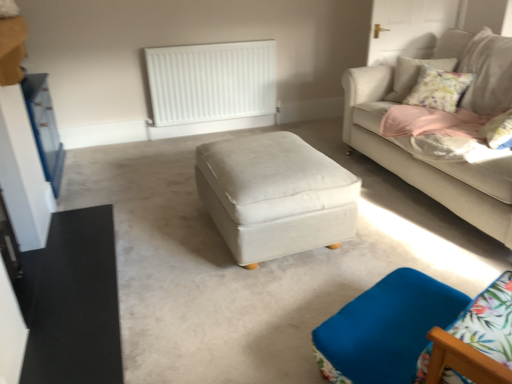
Question: Is the position of white matte radiator at upper center less distant than that of satin white ottoman at center?

Choices:
 (A) no
 (B) yes

Answer: (A)

Question: From the image's perspective, is white matte radiator at upper center beneath satin white ottoman at center?

Choices:
 (A) yes
 (B) no

Answer: (B)

Question: Is white matte radiator at upper center smaller than satin white ottoman at center?

Choices:
 (A) no
 (B) yes

Answer: (B)

Question: Is white matte radiator at upper center shorter than satin white ottoman at center?

Choices:
 (A) no
 (B) yes

Answer: (A)

Question: Does white matte radiator at upper center appear on the right side of satin white ottoman at center?

Choices:
 (A) no
 (B) yes

Answer: (A)

Question: Considering the relative sizes of white matte radiator at upper center and satin white ottoman at center in the image provided, is white matte radiator at upper center taller than satin white ottoman at center?

Choices:
 (A) no
 (B) yes

Answer: (B)

Question: Is light beige fabric couch at upper right placed right next to blue fabric swivel chair at lower right?

Choices:
 (A) no
 (B) yes

Answer: (A)

Question: Is light beige fabric couch at upper right turned away from blue fabric swivel chair at lower right?

Choices:
 (A) yes
 (B) no

Answer: (B)

Question: Considering the relative sizes of light beige fabric couch at upper right and blue fabric swivel chair at lower right in the image provided, is light beige fabric couch at upper right wider than blue fabric swivel chair at lower right?

Choices:
 (A) yes
 (B) no

Answer: (A)

Question: From a real-world perspective, is light beige fabric couch at upper right positioned under blue fabric swivel chair at lower right based on gravity?

Choices:
 (A) yes
 (B) no

Answer: (B)

Question: Can you confirm if light beige fabric couch at upper right is thinner than blue fabric swivel chair at lower right?

Choices:
 (A) yes
 (B) no

Answer: (B)

Question: From a real-world perspective, is light beige fabric couch at upper right located higher than blue fabric swivel chair at lower right?

Choices:
 (A) no
 (B) yes

Answer: (B)

Question: From a real-world perspective, does satin white ottoman at center sit lower than white matte radiator at upper center?

Choices:
 (A) yes
 (B) no

Answer: (A)